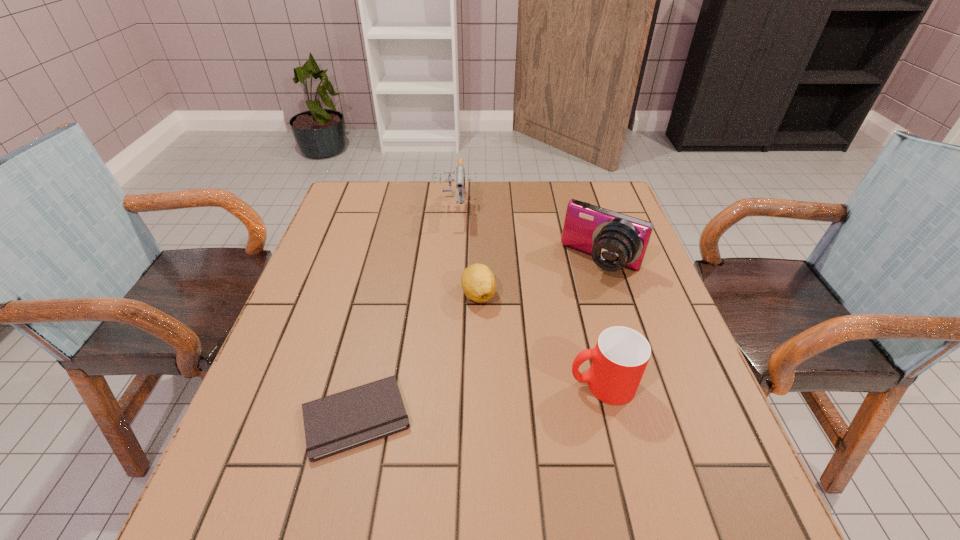
The width and height of the screenshot is (960, 540). I want to click on blank region between the cup and the camera, so click(x=602, y=323).

The height and width of the screenshot is (540, 960). Identify the location of free space between the second shortest object and the cup. (540, 340).

Where is `vacant space that is in between the camera and the lemon`? vacant space that is in between the camera and the lemon is located at coordinates (540, 278).

Where is `free spot between the gun and the checkbook`? This screenshot has width=960, height=540. free spot between the gun and the checkbook is located at coordinates (406, 313).

The image size is (960, 540). In order to click on free space between the lemon and the cup in this screenshot , I will do `click(540, 340)`.

At what (x,y) coordinates should I click in order to perform the action: click on free space between the lemon and the shortest object. Please return your answer as a coordinate pair (x, y). Image resolution: width=960 pixels, height=540 pixels. Looking at the image, I should click on (418, 356).

Identify the location of empty space that is in between the shortest object and the cup. (479, 401).

Identify the location of empty space between the gun and the cup. (529, 296).

Locate an element on the screen. Image resolution: width=960 pixels, height=540 pixels. vacant region between the second shortest object and the cup is located at coordinates (540, 340).

Where is `vacant space that is in between the gun and the cup`? This screenshot has height=540, width=960. vacant space that is in between the gun and the cup is located at coordinates (529, 296).